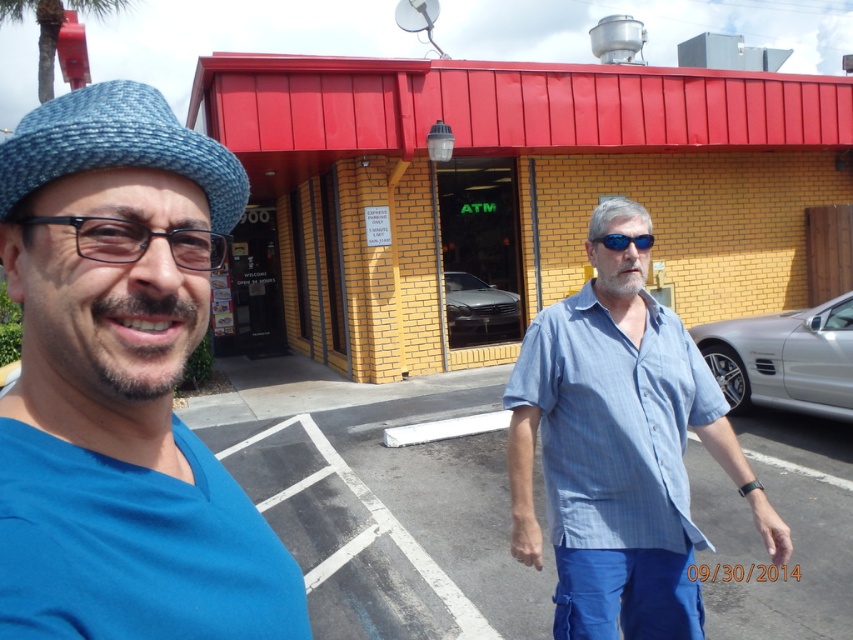
Question: Which of the following is the closest to the observer?

Choices:
 (A) (38, 483)
 (B) (631, 237)
 (C) (451, 326)

Answer: (A)

Question: In this image, where is blue fabric shirt at left located relative to blue woven hat at left?

Choices:
 (A) left
 (B) right

Answer: (B)

Question: Which point is closer to the camera?

Choices:
 (A) (144, 116)
 (B) (583, 481)
 (C) (592, 241)
 (D) (138, 237)

Answer: (D)

Question: Can you confirm if blue woven hat at left is positioned above silver metallic car at right?

Choices:
 (A) yes
 (B) no

Answer: (A)

Question: Does blue striped shirt at right appear over blue woven hat at left?

Choices:
 (A) no
 (B) yes

Answer: (A)

Question: Which of the following is the farthest from the observer?

Choices:
 (A) blue striped shirt at right
 (B) blue reflective sunglasses at center
 (C) black plastic glasses at left
 (D) satin silver car at center

Answer: (D)